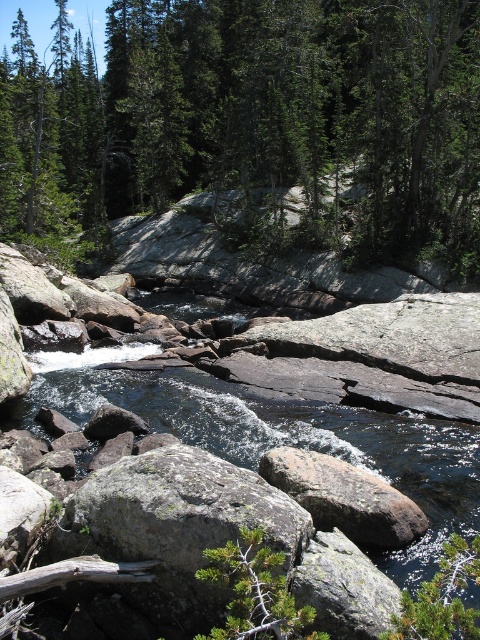
You are standing in the middle of the rocky riverbed and see the green leafy tree at center and the rusty metallic rock at center. Which object is closer to you?

The green leafy tree at center is closer to you because the rusty metallic rock at center is behind it.

You are standing at the edge of the river and see the green leafy tree at center and the rusty metallic rock at center. Which object is positioned more to the left from your perspective?

The green leafy tree at center is positioned more to the left than the rusty metallic rock at center from your perspective.

You are a hiker who wants to cross the river. You see a green leafy tree at center and a rusty metallic rock at center. Which one is closer to your current position?

The question cannot be answered with the provided information because the distance between the two objects is given, but their individual distances to the hiker are unknown.